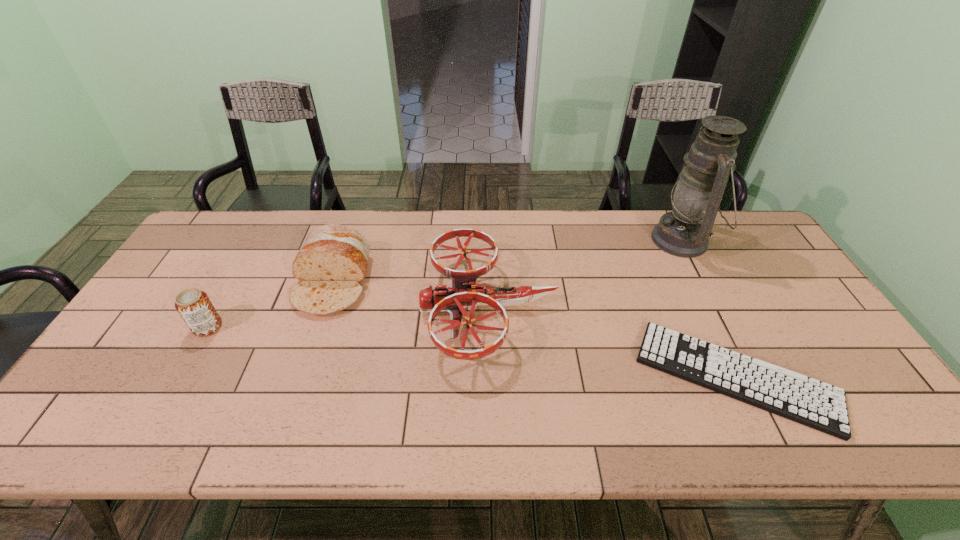
Point out which object is positioned as the nearest to the bread. Please provide its 2D coordinates. Your answer should be formatted as a tuple, i.e. [(x, y)], where the tuple contains the x and y coordinates of a point satisfying the conditions above.

[(194, 306)]

Locate an element on the screen. This screenshot has height=540, width=960. free spot that satisfies the following two spatial constraints: 1. at the sliced end of the bread; 2. on the left side of the drone is located at coordinates (324, 308).

You are a GUI agent. You are given a task and a screenshot of the screen. Output one action in this format:
    pyautogui.click(x=<x>, y=<y>)
    Task: Click on the vacant region that satisfies the following two spatial constraints: 1. on the back side of the beer can; 2. on the left side of the drone
    The image size is (960, 540).
    Given the screenshot: What is the action you would take?
    pyautogui.click(x=218, y=308)

The image size is (960, 540). What are the coordinates of `free spot that satisfies the following two spatial constraints: 1. at the sliced end of the computer keyboard; 2. on the left side of the bread` in the screenshot? It's located at (300, 376).